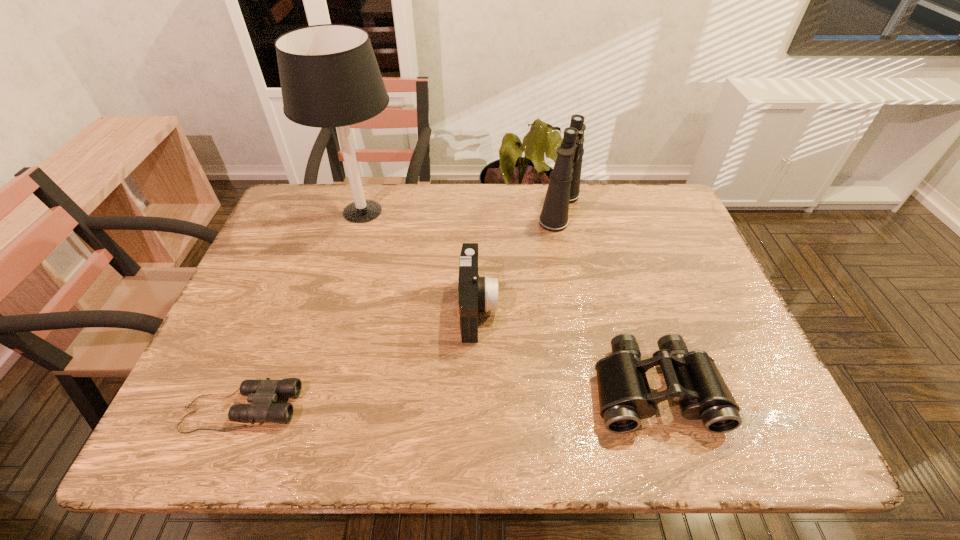
What are the coordinates of `the tallest object` in the screenshot? It's located at (329, 75).

Where is `the tallest binoculars`? The height and width of the screenshot is (540, 960). the tallest binoculars is located at coordinates (564, 186).

At what (x,y) coordinates should I click in order to perform the action: click on the fourth shortest object. Please return your answer as a coordinate pair (x, y). This screenshot has height=540, width=960. Looking at the image, I should click on (564, 186).

Where is `camcorder`? Image resolution: width=960 pixels, height=540 pixels. camcorder is located at coordinates pyautogui.click(x=476, y=294).

At what (x,y) coordinates should I click in order to perform the action: click on the third object from right to left. Please return your answer as a coordinate pair (x, y). This screenshot has height=540, width=960. Looking at the image, I should click on (476, 294).

Where is `the second shortest binoculars`? This screenshot has width=960, height=540. the second shortest binoculars is located at coordinates (692, 378).

The image size is (960, 540). In order to click on the shortest object in this screenshot , I will do `click(262, 394)`.

Find the location of `the leftmost binoculars`. the leftmost binoculars is located at coordinates (262, 394).

This screenshot has width=960, height=540. Identify the location of free point located 0.310m on the right of the tallest object. (508, 212).

Image resolution: width=960 pixels, height=540 pixels. Identify the location of vacant space positioned 0.120m on the left of the tallest binoculars. (497, 209).